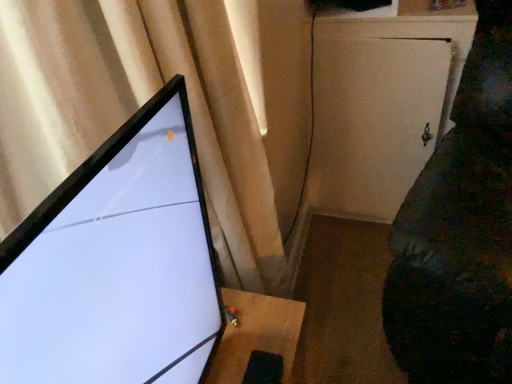
Question: Does velvet dark green couch at right have a smaller size compared to matte black monitor at left?

Choices:
 (A) yes
 (B) no

Answer: (B)

Question: From the image's perspective, does velvet dark green couch at right appear higher than matte black monitor at left?

Choices:
 (A) no
 (B) yes

Answer: (B)

Question: From the image's perspective, is velvet dark green couch at right beneath matte black monitor at left?

Choices:
 (A) no
 (B) yes

Answer: (A)

Question: From a real-world perspective, is velvet dark green couch at right on top of matte black monitor at left?

Choices:
 (A) yes
 (B) no

Answer: (B)

Question: Would you say matte black monitor at left is part of velvet dark green couch at right's contents?

Choices:
 (A) yes
 (B) no

Answer: (B)

Question: In the image, is matte beige curtain at upper left positioned in front of or behind white matte cabinet at right?

Choices:
 (A) behind
 (B) front

Answer: (B)

Question: In the image, is matte beige curtain at upper left on the left side or the right side of white matte cabinet at right?

Choices:
 (A) left
 (B) right

Answer: (A)

Question: Is point (39, 165) closer or farther from the camera than point (391, 109)?

Choices:
 (A) farther
 (B) closer

Answer: (B)

Question: From their relative heights in the image, would you say matte beige curtain at upper left is taller or shorter than white matte cabinet at right?

Choices:
 (A) tall
 (B) short

Answer: (A)

Question: Is matte black monitor at left taller or shorter than matte beige curtain at upper left?

Choices:
 (A) short
 (B) tall

Answer: (A)

Question: Considering the positions of matte black monitor at left and matte beige curtain at upper left in the image, is matte black monitor at left wider or thinner than matte beige curtain at upper left?

Choices:
 (A) wide
 (B) thin

Answer: (B)

Question: Is matte black monitor at left spatially inside matte beige curtain at upper left, or outside of it?

Choices:
 (A) outside
 (B) inside

Answer: (A)

Question: From a real-world perspective, is matte black monitor at left positioned above or below matte beige curtain at upper left?

Choices:
 (A) below
 (B) above

Answer: (B)

Question: Looking at the image, does velvet dark green couch at right seem bigger or smaller compared to white matte cabinet at right?

Choices:
 (A) big
 (B) small

Answer: (A)

Question: Is point coord(420,266) positioned closer to the camera than point coord(347,165)?

Choices:
 (A) farther
 (B) closer

Answer: (B)